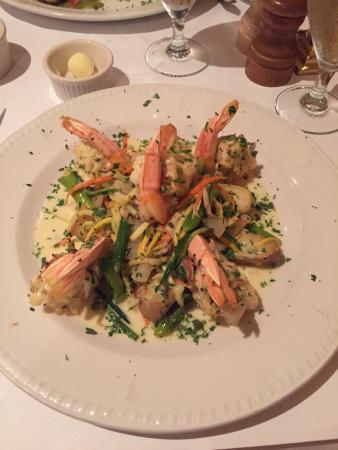
Identify the location of glass. (175, 15), (328, 50).